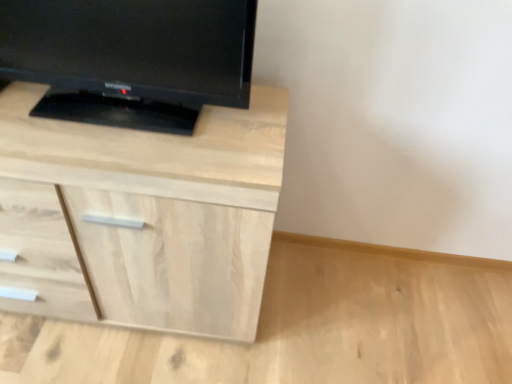
Question: From a real-world perspective, is matte black tv at upper left physically located above or below light wood chest of drawers at upper left?

Choices:
 (A) below
 (B) above

Answer: (B)

Question: From their relative heights in the image, would you say matte black tv at upper left is taller or shorter than light wood chest of drawers at upper left?

Choices:
 (A) short
 (B) tall

Answer: (A)

Question: Is matte black tv at upper left spatially inside light wood chest of drawers at upper left, or outside of it?

Choices:
 (A) outside
 (B) inside

Answer: (A)

Question: Is point (87, 271) closer or farther from the camera than point (204, 41)?

Choices:
 (A) farther
 (B) closer

Answer: (A)

Question: Relative to matte black tv at upper left, is light wood chest of drawers at upper left in front or behind?

Choices:
 (A) behind
 (B) front

Answer: (A)

Question: Would you say light wood chest of drawers at upper left is to the left or to the right of matte black tv at upper left in the picture?

Choices:
 (A) left
 (B) right

Answer: (A)

Question: Considering the positions of light wood chest of drawers at upper left and matte black tv at upper left in the image, is light wood chest of drawers at upper left wider or thinner than matte black tv at upper left?

Choices:
 (A) thin
 (B) wide

Answer: (B)